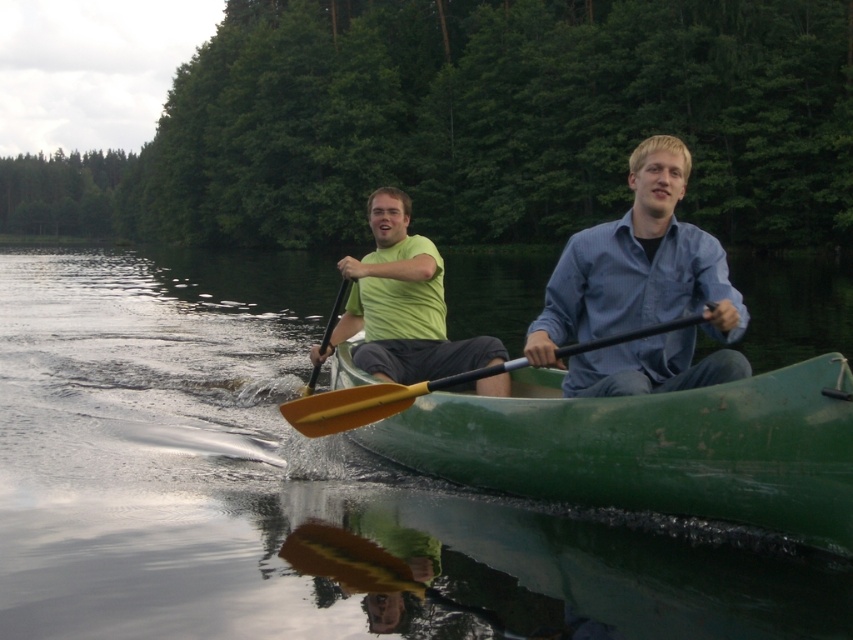
How distant is green matte canoe at center from yellow wood paddle at center?

20.54 inches

Does point (817, 364) lie behind point (427, 392)?

No, it is in front of (427, 392).

Find the location of a particular element. The width and height of the screenshot is (853, 640). green matte canoe at center is located at coordinates (651, 448).

Which is more to the left, matte green shirt at center or yellow wood paddle at center?

matte green shirt at center is more to the left.

In the scene shown: Which is below, matte green shirt at center or yellow wood paddle at center?

Positioned lower is yellow wood paddle at center.

Find the location of `matte green shirt at center`. matte green shirt at center is located at coordinates tap(401, 305).

Locate an element on the screen. matte green shirt at center is located at coordinates (401, 305).

Is blue cotton shirt at center to the right of matte green shirt at center from the viewer's perspective?

Indeed, blue cotton shirt at center is positioned on the right side of matte green shirt at center.

Describe the element at coordinates (637, 266) in the screenshot. I see `blue cotton shirt at center` at that location.

Image resolution: width=853 pixels, height=640 pixels. I want to click on blue cotton shirt at center, so (x=637, y=266).